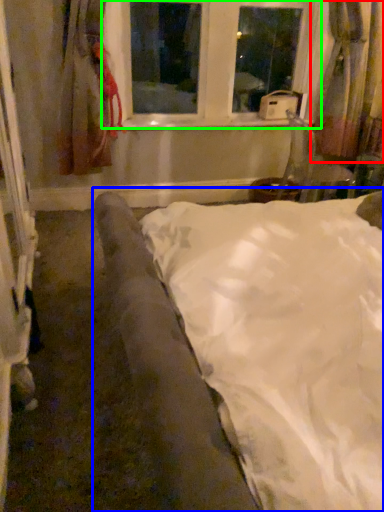
Question: Which object is positioned farthest from curtain (highlighted by a red box)? Select from bed (highlighted by a blue box) and window (highlighted by a green box).

Choices:
 (A) bed
 (B) window

Answer: (A)